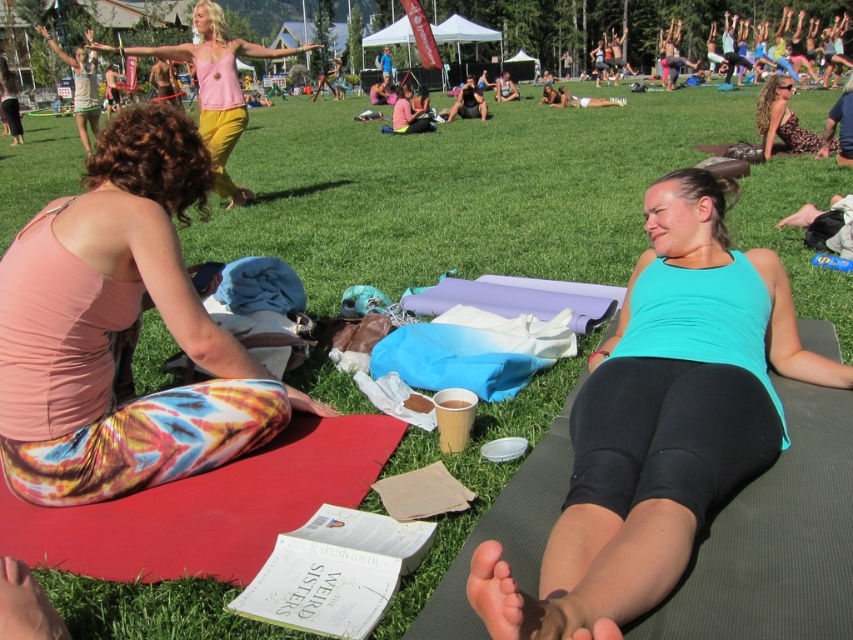
Between matte pink tank top at left and teal fabric tank top at center, which one has less height?

teal fabric tank top at center

Can you confirm if matte pink tank top at left is thinner than teal fabric tank top at center?

Indeed, matte pink tank top at left has a lesser width compared to teal fabric tank top at center.

Is point (132, 112) farther from camera compared to point (641, 406)?

Yes, it is behind point (641, 406).

I want to click on matte pink tank top at left, so click(120, 332).

Is teal fabric tank top at center positioned before pink matte tank top at upper center?

Yes, it is.

Identify the location of teal fabric tank top at center. Image resolution: width=853 pixels, height=640 pixels. [657, 433].

Who is taller, pink matte tank top at upper center or printed floral dress at upper right?

Standing taller between the two is pink matte tank top at upper center.

Which is behind, point (231, 56) or point (791, 128)?

The point (791, 128) is behind.

The height and width of the screenshot is (640, 853). Identify the location of pink matte tank top at upper center. (213, 84).